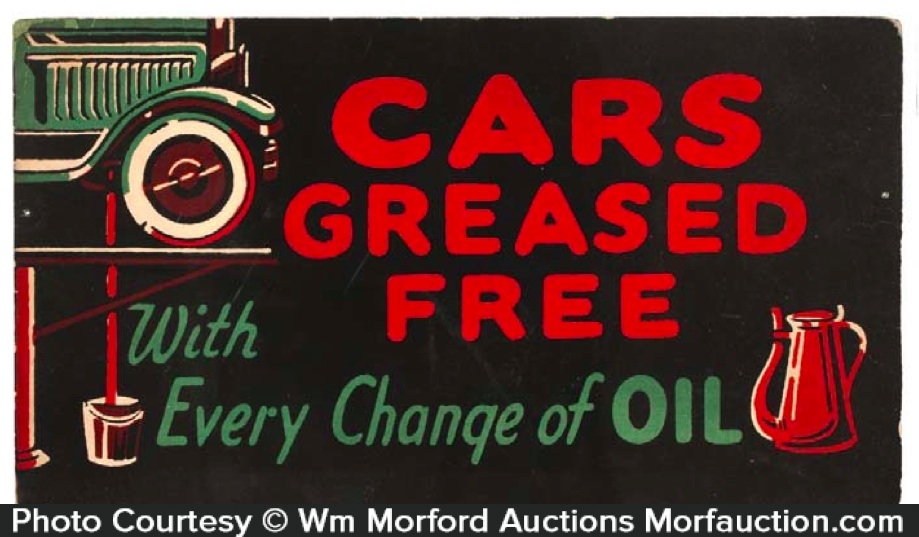
Locate an element on the screen. The width and height of the screenshot is (919, 537). handle is located at coordinates (865, 355).